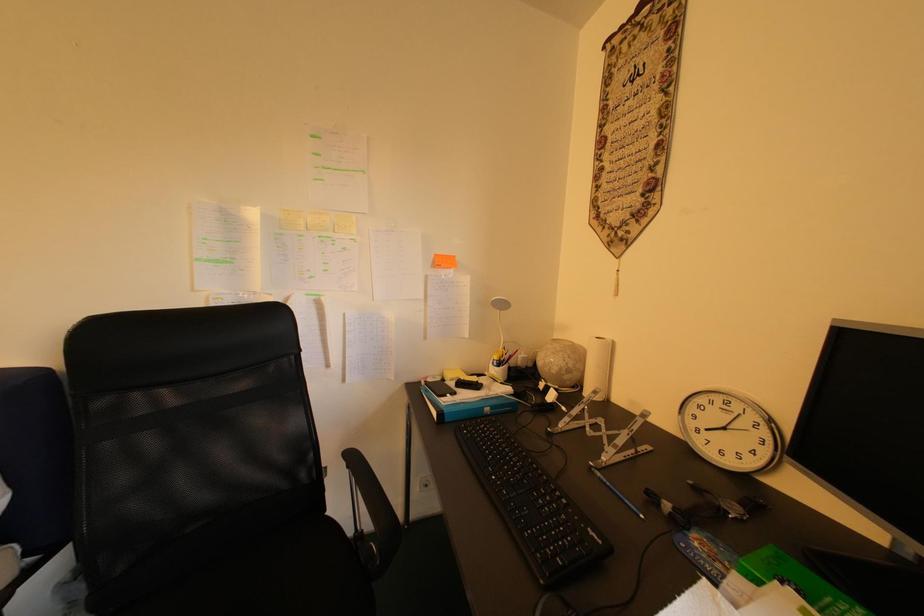
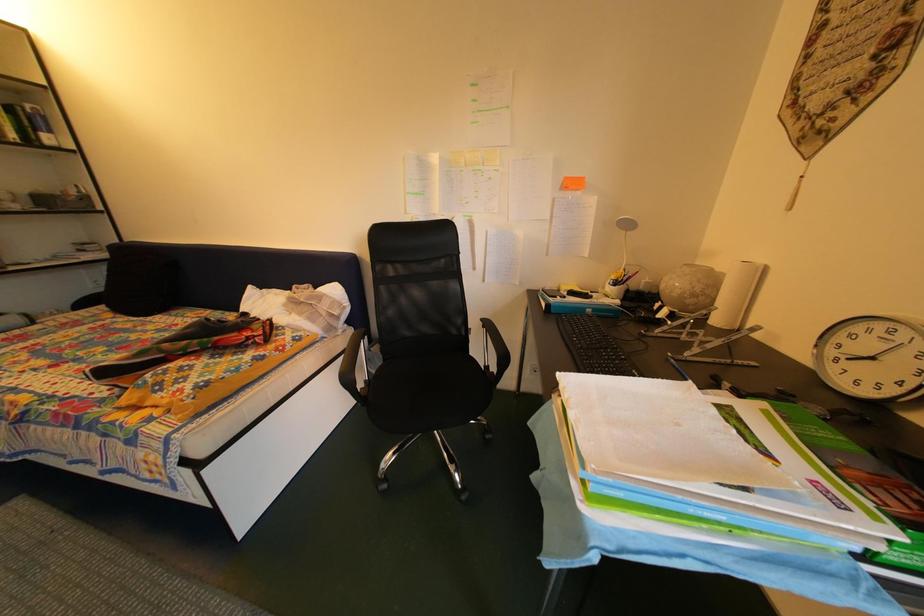
Question: How did the camera likely rotate?

Choices:
 (A) Left
 (B) Right
 (C) Up
 (D) Down

Answer: (A)